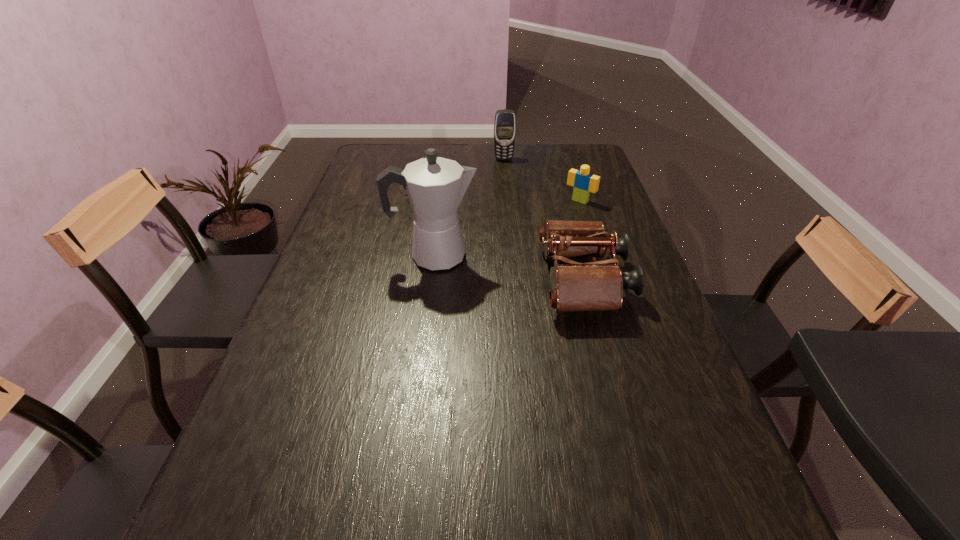
Find the location of `cellular telephone present at the far edge`. cellular telephone present at the far edge is located at coordinates (505, 120).

At what (x,y) coordinates should I click in order to perform the action: click on object positioned at the left edge. Please return your answer as a coordinate pair (x, y). This screenshot has width=960, height=540. Looking at the image, I should click on (386, 167).

Identify the location of binoculars that is positioned at the right edge. (598, 285).

Where is `Lego that is at the right edge`? Lego that is at the right edge is located at coordinates (584, 182).

This screenshot has width=960, height=540. Find the location of `object present at the far left corner`. object present at the far left corner is located at coordinates (386, 167).

This screenshot has width=960, height=540. I want to click on vacant area at the far edge, so click(x=408, y=150).

Identify the location of free space at the near edge. (416, 462).

Find the location of a particular element. blank space at the left edge is located at coordinates (395, 189).

In the image, there is a desktop. Find the location of `vacant space at the right edge`. vacant space at the right edge is located at coordinates (668, 360).

Image resolution: width=960 pixels, height=540 pixels. I want to click on vacant space at the far left corner of the desktop, so click(388, 150).